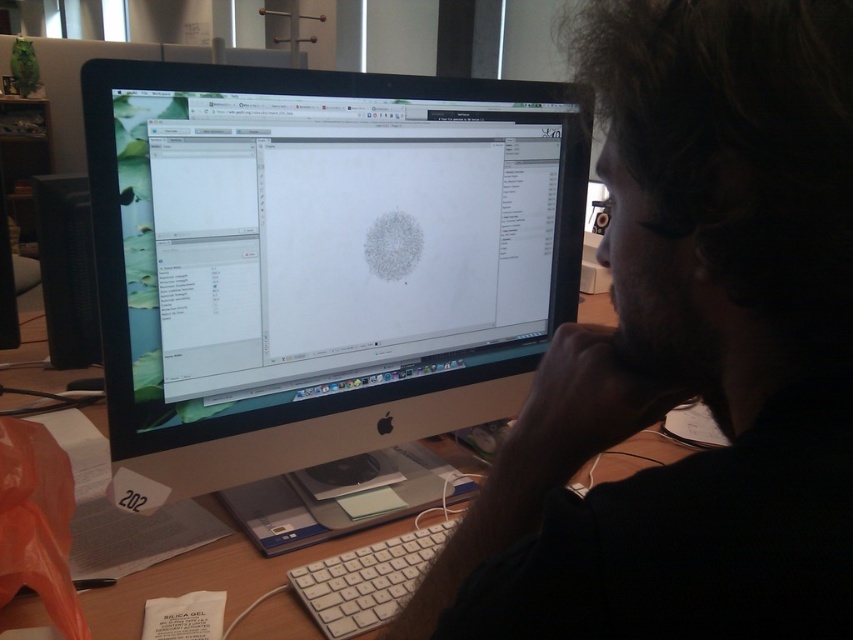
From the picture: Between black glossy monitor at center and white plastic keyboard at lower center, which one has more height?

With more height is black glossy monitor at center.

Which is in front, point (447, 208) or point (343, 602)?

Point (343, 602) is in front.

The width and height of the screenshot is (853, 640). I want to click on black glossy monitor at center, so click(x=320, y=260).

Who is positioned more to the right, black matte monitor at center or black plastic desktop computer at left?

black matte monitor at center

How far apart are black matte monitor at center and black plastic desktop computer at left?

They are 1.02 meters apart.

Between point (763, 280) and point (74, 364), which one is positioned behind?

The point (74, 364) is behind.

Identify the location of black matte monitor at center. The width and height of the screenshot is (853, 640). (689, 353).

Who is lower down, black matte monitor at center or white plastic keyboard at lower center?

white plastic keyboard at lower center is lower down.

The height and width of the screenshot is (640, 853). I want to click on black matte monitor at center, so click(689, 353).